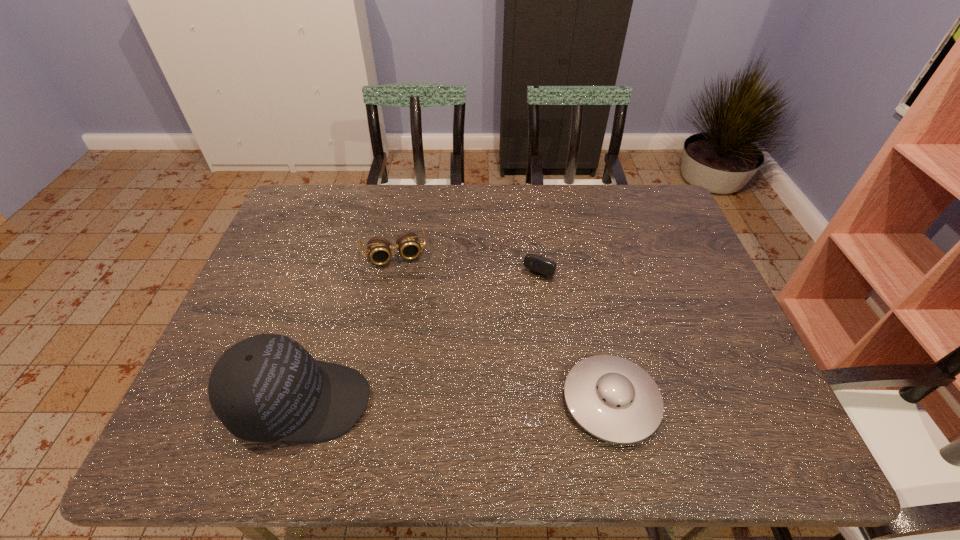
Image resolution: width=960 pixels, height=540 pixels. I want to click on free space on the desktop that is between the baseball cap and the saucer and is positioned through the lenses of the goggles, so pyautogui.click(x=423, y=402).

Where is `vacant space on the desktop that is between the tallest object and the saucer and is positioned on the front-facing side of the webcam`? Image resolution: width=960 pixels, height=540 pixels. vacant space on the desktop that is between the tallest object and the saucer and is positioned on the front-facing side of the webcam is located at coordinates (456, 402).